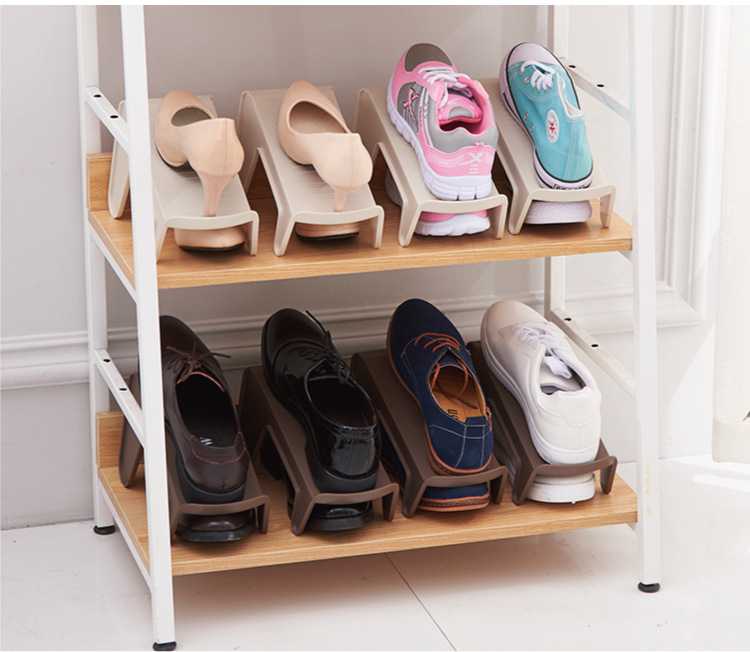
Where is `white slats`? Image resolution: width=750 pixels, height=652 pixels. white slats is located at coordinates (105, 107), (124, 280), (120, 393), (117, 523), (634, 250), (624, 110), (624, 379), (636, 526).